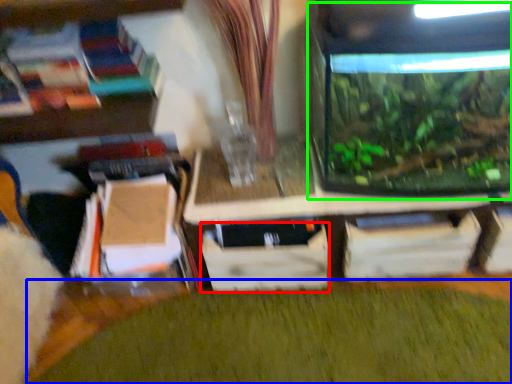
Question: Based on their relative distances, which object is nearer to drawer (highlighted by a red box)? Choose from plant (highlighted by a blue box) and glass box (highlighted by a green box).

Choices:
 (A) plant
 (B) glass box

Answer: (A)